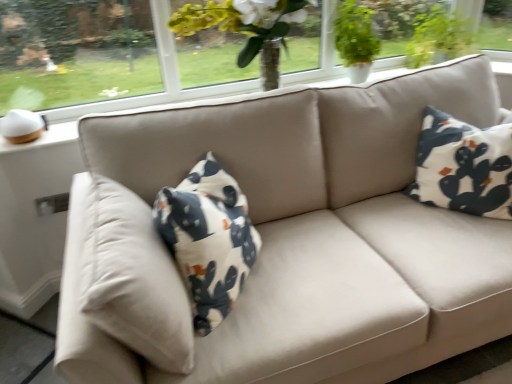
This screenshot has width=512, height=384. Identify the location of transparent glass window at upper left. (75, 52).

You are a GUI agent. You are given a task and a screenshot of the screen. Output one action in this format:
    pyautogui.click(x=<x>, y=<y>)
    Task: Click on the green matte plant at upper right
    
    Given the screenshot: What is the action you would take?
    pyautogui.click(x=355, y=39)

Where is `white cotton pillow at right`? This screenshot has height=384, width=512. white cotton pillow at right is located at coordinates click(464, 166).

Between white cotton pillow at right and transparent glass window at upper left, which one has more height?

white cotton pillow at right is taller.

Which object is closer to the camera, white cotton pillow at right or transparent glass window at upper left?

white cotton pillow at right is more forward.

Considering the positions of points (509, 210) and (55, 89), is point (509, 210) farther from camera compared to point (55, 89)?

That is False.

Is white cotton pillow at right to the left of transparent glass window at upper left from the viewer's perspective?

No.

Which object is closer to the camera, green matte plant at upper right or white cotton pillow at right?

white cotton pillow at right is more forward.

Considering the positions of objects green matte plant at upper right and white cotton pillow at right in the image provided, who is more to the right, green matte plant at upper right or white cotton pillow at right?

white cotton pillow at right is more to the right.

Looking at this image, is green matte plant at upper right completely or partially inside transparent glass window at upper left?

No.

Consider the image. Is transparent glass window at upper left smaller than green matte plant at upper right?

Yes.

Does transparent glass window at upper left touch green matte plant at upper right?

No.

How different are the orientations of transparent glass window at upper left and green matte plant at upper right in degrees?

The angular difference between transparent glass window at upper left and green matte plant at upper right is 0.568 degrees.

Can you tell me how much transparent glass window at upper left and white cotton pillow at right differ in facing direction?

They differ by 52.5 degrees in their facing directions.

Which of these two, transparent glass window at upper left or white cotton pillow at right, stands shorter?

With less height is transparent glass window at upper left.

How much distance is there between transparent glass window at upper left and white cotton pillow at right?

They are 4.80 feet apart.

From the image's perspective, is transparent glass window at upper left on white cotton pillow at right?

Yes, from the image's perspective, transparent glass window at upper left is over white cotton pillow at right.

Considering the positions of objects green matte plant at upper right and transparent glass window at upper left in the image provided, who is more to the right, green matte plant at upper right or transparent glass window at upper left?

green matte plant at upper right is more to the right.

Which is closer, (356, 19) or (140, 69)?

The point (140, 69) is closer.

From a real-world perspective, does green matte plant at upper right stand above transparent glass window at upper left?

No, from a real-world perspective, green matte plant at upper right is not over transparent glass window at upper left

Between white cotton pillow at right and green matte plant at upper right, which one is positioned in front?

Positioned in front is white cotton pillow at right.

In the image, there is a green matte plant at upper right. Where is `pillow below it (from the image's perspective)`? Image resolution: width=512 pixels, height=384 pixels. pillow below it (from the image's perspective) is located at coordinates (464, 166).

Between white cotton pillow at right and green matte plant at upper right, which one has less height?

Standing shorter between the two is green matte plant at upper right.

At what (x,y) coordinates should I click in order to perform the action: click on window screen that is above the white cotton pillow at right (from a real-world perspective). Please return your answer as a coordinate pair (x, y). Looking at the image, I should click on (75, 52).

Image resolution: width=512 pixels, height=384 pixels. What are the coordinates of `pillow that appears in front of the green matte plant at upper right` in the screenshot? It's located at (464, 166).

Which object lies further to the anchor point transparent glass window at upper left, white cotton pillow at right or green matte plant at upper right?

white cotton pillow at right is further to transparent glass window at upper left.

When comparing their distances from white cotton pillow at right, does green matte plant at upper right or transparent glass window at upper left seem further?

Among the two, transparent glass window at upper left is located further to white cotton pillow at right.

Looking at the image, which one is located further to white cotton pillow at right, transparent glass window at upper left or green matte plant at upper right?

transparent glass window at upper left is positioned further to the anchor white cotton pillow at right.

From the image, which object appears to be farther from transparent glass window at upper left, green matte plant at upper right or white cotton pillow at right?

white cotton pillow at right is further to transparent glass window at upper left.

Estimate the real-world distances between objects in this image. Which object is closer to green matte plant at upper right, transparent glass window at upper left or white cotton pillow at right?

white cotton pillow at right is positioned closer to the anchor green matte plant at upper right.

From the image, which object appears to be farther from green matte plant at upper right, white cotton pillow at right or transparent glass window at upper left?

transparent glass window at upper left is positioned further to the anchor green matte plant at upper right.

Where is `houseplant between transparent glass window at upper left and white cotton pillow at right in the horizontal direction`? houseplant between transparent glass window at upper left and white cotton pillow at right in the horizontal direction is located at coordinates (355, 39).